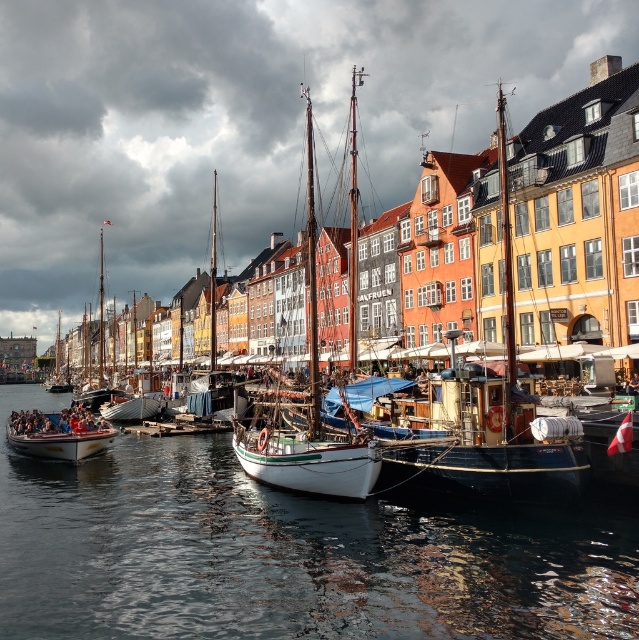
Who is more distant from viewer, (394, 474) or (266, 432)?

The point (266, 432) is more distant.

Does wooden sailboat at center appear under white matte sailboat at center?

Correct, wooden sailboat at center is located below white matte sailboat at center.

Find the location of a particular element. This screenshot has width=639, height=640. wooden sailboat at center is located at coordinates (486, 420).

Who is more forward, (465,442) or (12,428)?

Positioned in front is point (465,442).

Between wooden sailboat at center and wooden polished boat at lower left, which one is positioned higher?

Positioned higher is wooden sailboat at center.

Which is behind, point (443, 387) or point (35, 419)?

The point (35, 419) is more distant.

Find the location of a particular element. wooden sailboat at center is located at coordinates (486, 420).

What do you see at coordinates (286, 554) in the screenshot?
I see `clear water at center` at bounding box center [286, 554].

From the picture: Can you confirm if clear water at center is taller than white matte sailboat at center?

No.

Between point (162, 566) and point (311, 156), which one is positioned behind?

The point (311, 156) is behind.

This screenshot has width=639, height=640. Find the location of `clear water at center`. clear water at center is located at coordinates (286, 554).